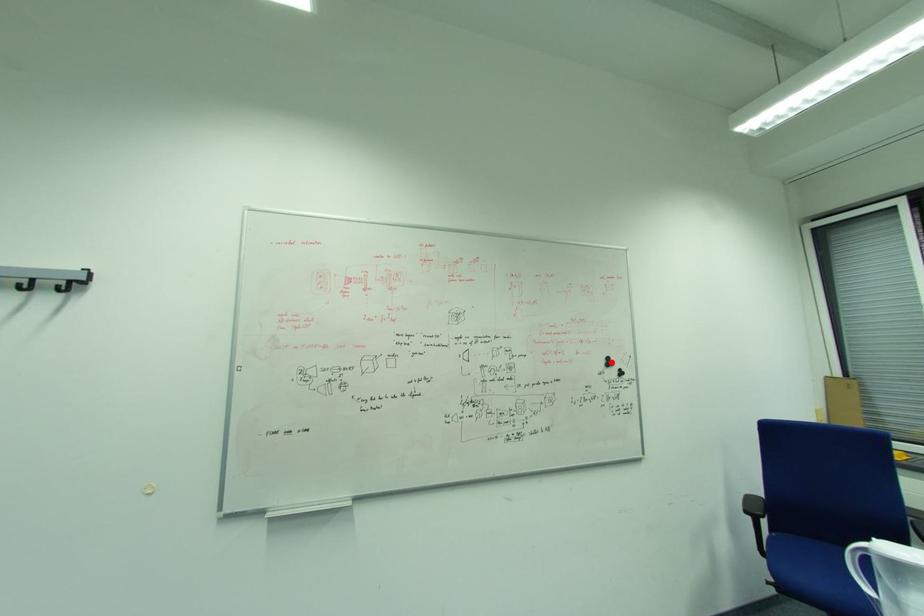
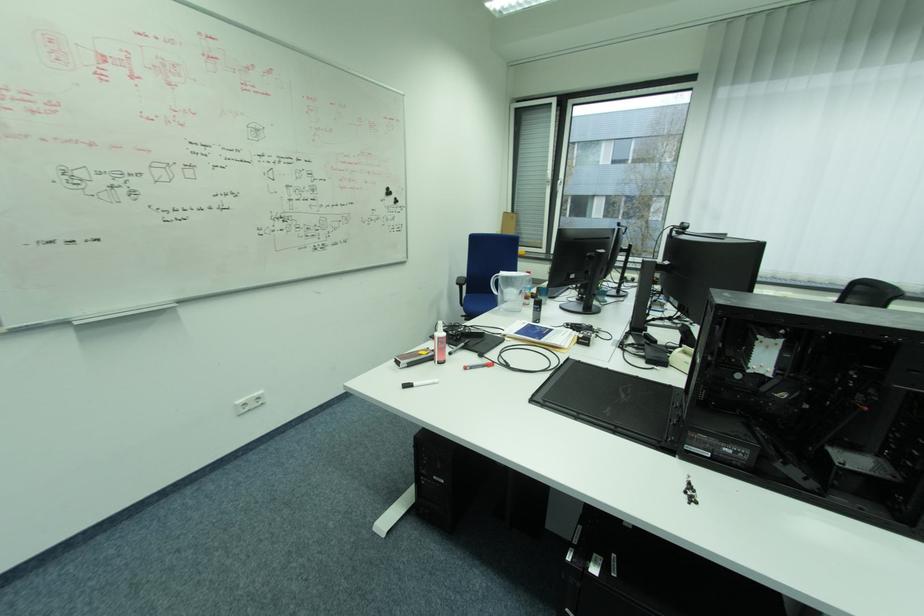
The point at the highlighted location is marked in the first image. Where is the corresponding point in the second image?

(392, 192)